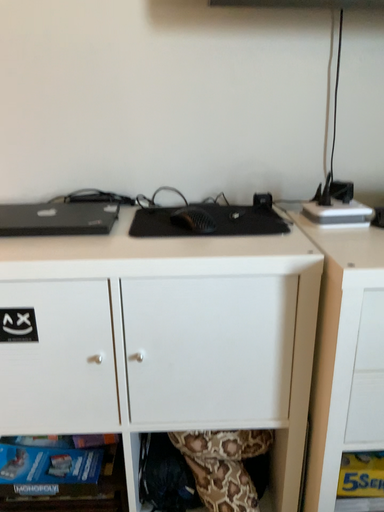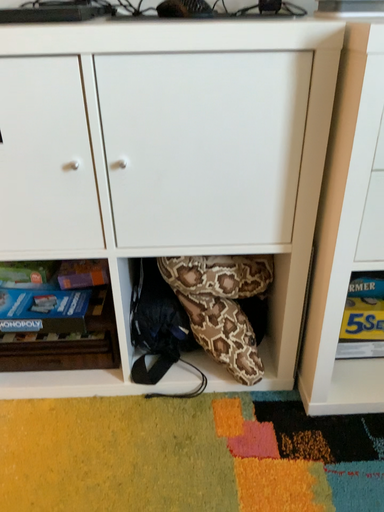
Question: How did the camera likely rotate when shooting the video?

Choices:
 (A) rotated downward
 (B) rotated upward

Answer: (A)